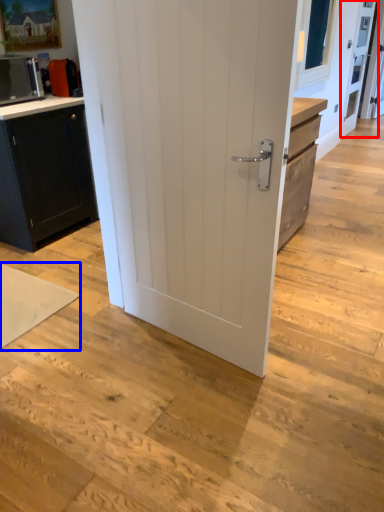
Question: Which object is closer to the camera taking this photo, screen door (highlighted by a red box) or yoga mat (highlighted by a blue box)?

Choices:
 (A) screen door
 (B) yoga mat

Answer: (B)